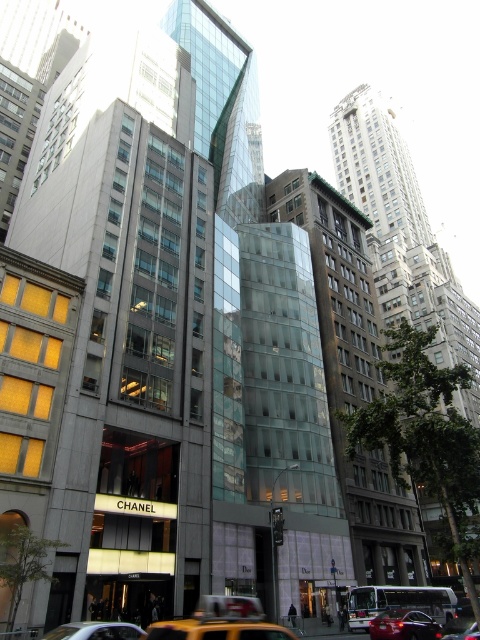
Is yellow matte taxi cab at center to the left of metallic yellow taxi cab at center from the viewer's perspective?

Correct, you'll find yellow matte taxi cab at center to the left of metallic yellow taxi cab at center.

Between yellow matte taxi cab at center and metallic yellow taxi cab at center, which one has more height?

metallic yellow taxi cab at center

Identify the location of yellow matte taxi cab at center. (96, 630).

Can you confirm if shiny black sedan at center is positioned to the right of metallic yellow taxi cab at center?

Incorrect, shiny black sedan at center is not on the right side of metallic yellow taxi cab at center.

Who is more forward, (403,616) or (477,625)?

Point (477,625) is in front.

Find the location of a particular element. Image resolution: width=480 pixels, height=640 pixels. shiny black sedan at center is located at coordinates (404, 625).

Who is higher up, yellow rubber taxi at lower center or shiny black sedan at center?

Positioned higher is yellow rubber taxi at lower center.

Which is more to the right, yellow rubber taxi at lower center or shiny black sedan at center?

shiny black sedan at center is more to the right.

The width and height of the screenshot is (480, 640). What do you see at coordinates (220, 621) in the screenshot?
I see `yellow rubber taxi at lower center` at bounding box center [220, 621].

You are a GUI agent. You are given a task and a screenshot of the screen. Output one action in this format:
    pyautogui.click(x=<x>, y=<y>)
    Task: Click on the yellow rubber taxi at lower center
    Image resolution: width=480 pixels, height=640 pixels.
    Given the screenshot: What is the action you would take?
    pyautogui.click(x=220, y=621)